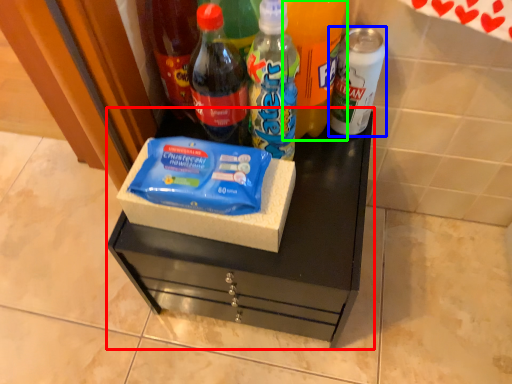
Question: Considering the real-world distances, which object is farthest from vanity (highlighted by a red box)? bottle (highlighted by a blue box) or bottle (highlighted by a green box)?

Choices:
 (A) bottle
 (B) bottle

Answer: (A)